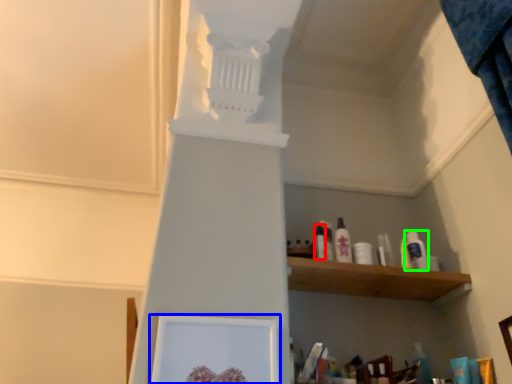
Question: Which object is positioned farthest from toiletry (highlighted by a red box)? Select from picture frame (highlighted by a blue box) and toiletry (highlighted by a green box).

Choices:
 (A) picture frame
 (B) toiletry

Answer: (A)